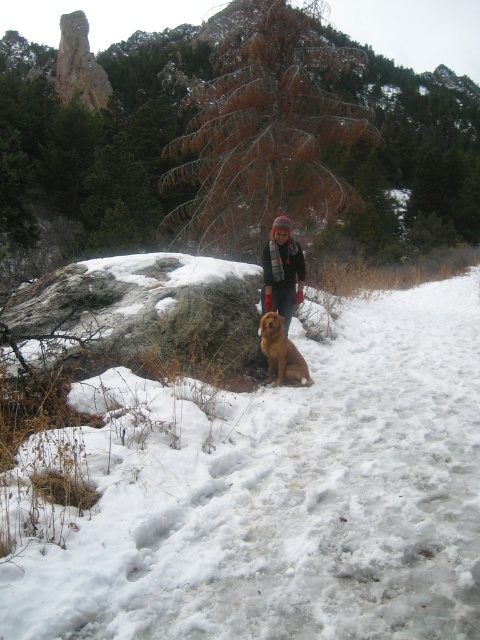
Does knitted wool hat at center appear on the left side of golden fur dog at center?

Incorrect, knitted wool hat at center is not on the left side of golden fur dog at center.

Is point (300, 273) farther from camera compared to point (266, 324)?

Yes, it is behind point (266, 324).

Between point (294, 257) and point (289, 365), which one is positioned in front?

Point (289, 365) is in front.

Locate an element on the screen. This screenshot has width=480, height=640. knitted wool hat at center is located at coordinates (282, 272).

From the picture: Who is positioned more to the right, white fluffy snow at center or golden fur dog at center?

Positioned to the right is white fluffy snow at center.

Who is higher up, white fluffy snow at center or golden fur dog at center?

Positioned higher is golden fur dog at center.

Does point (288, 512) come behind point (271, 320)?

No.

You are a GUI agent. You are given a task and a screenshot of the screen. Output one action in this format:
    pyautogui.click(x=<x>, y=<y>)
    Task: Click on the white fluffy snow at center
    The width and height of the screenshot is (480, 640).
    Given the screenshot: What is the action you would take?
    pyautogui.click(x=280, y=496)

Is point (387, 324) positioned in front of point (282, 301)?

No, (387, 324) is behind (282, 301).

Is point (19, 580) less distant than point (288, 323)?

Yes, it is in front of point (288, 323).

Locate an element on the screen. The height and width of the screenshot is (640, 480). white fluffy snow at center is located at coordinates (280, 496).